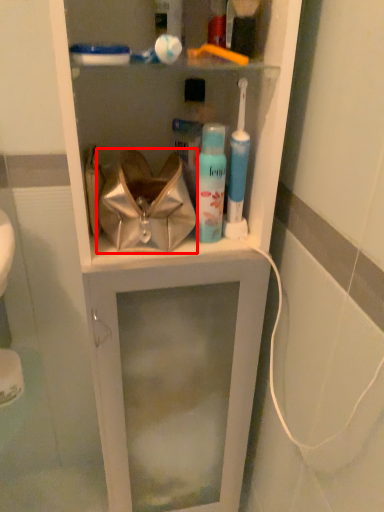
Question: From the image, what is the correct spatial relationship of handbag (annotated by the red box) in relation to toiletry?

Choices:
 (A) right
 (B) left

Answer: (B)